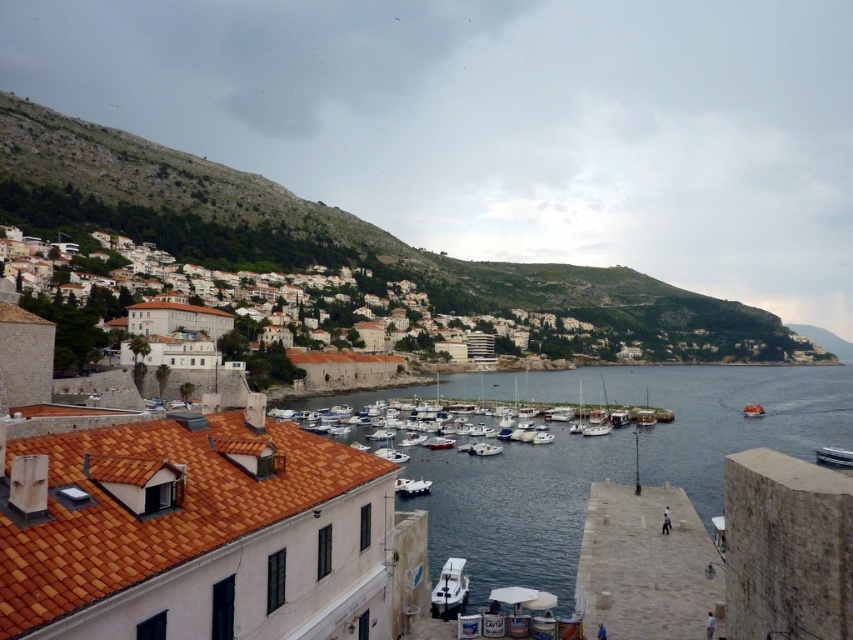
Does point (431, 592) lie in front of point (485, 449)?

Yes.

From the picture: Can you confirm if white glossy boat at lower center is smaller than white glossy boat at center?

Yes, white glossy boat at lower center is smaller than white glossy boat at center.

Does point (450, 605) come in front of point (485, 452)?

Yes, point (450, 605) is in front of point (485, 452).

Find the location of `white glossy boat at lower center`. white glossy boat at lower center is located at coordinates (450, 589).

How much distance is there between white glossy boat at center and orange fabric lifeboat at lower right?

white glossy boat at center is 60.79 meters away from orange fabric lifeboat at lower right.

Who is more distant from viewer, (489, 448) or (755, 412)?

The point (755, 412) is behind.

Based on the photo, who is more forward, (x=488, y=444) or (x=761, y=416)?

Point (x=488, y=444)

You are a GUI agent. You are given a task and a screenshot of the screen. Output one action in this format:
    pyautogui.click(x=<x>, y=<y>)
    Task: Click on the white glossy boat at center
    This screenshot has height=640, width=853.
    Given the screenshot: What is the action you would take?
    pyautogui.click(x=485, y=449)

Who is lower down, clear blue water at center or white glossy boat at lower right?

clear blue water at center is below.

Can you confirm if clear blue water at center is bigger than white glossy boat at lower right?

Indeed, clear blue water at center has a larger size compared to white glossy boat at lower right.

Between point (500, 579) and point (843, 460), which one is positioned behind?

Point (843, 460)

The image size is (853, 640). What are the coordinates of `clear blue water at center` in the screenshot? It's located at (515, 506).